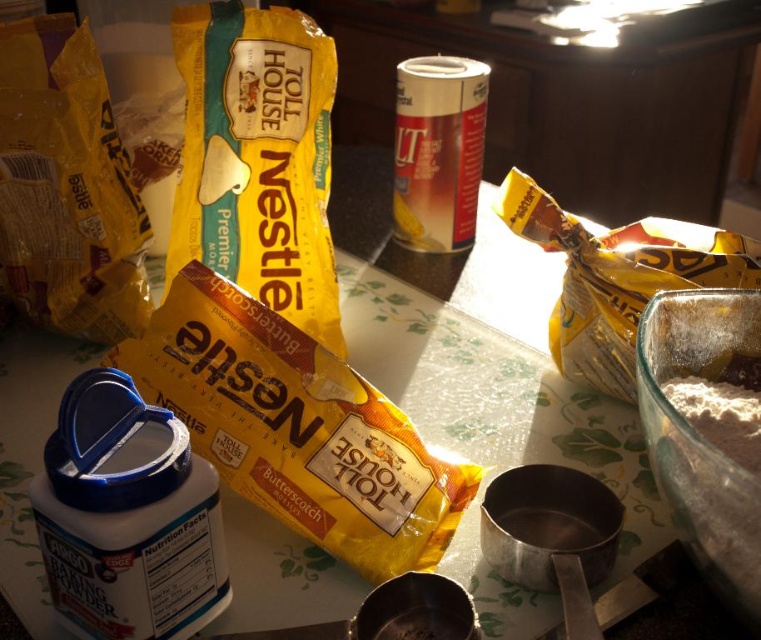
You are a baker preparing to measure ingredients for a recipe. You need to place both the yellow matte plastic bag of nestle toll house premier butter at center and the white powdery flour at right onto a shelf that can only hold items no wider than 12 inches. Based on their widths, will both items fit on the shelf together?

The yellow matte plastic bag of nestle toll house premier butter at center might be wider than white powdery flour at right. Since the shelf has a 12 inch width limit, if the bag is wider than the flour, their combined width may exceed the shelf capacity. However, without exact measurements, it is uncertain if both will fit.

You are a baker preparing to measure ingredients for a recipe. You need to retrieve the flour first. Based on the scene, where is the white powdery flour at right located in relation to the metallic silver can at center?

The white powdery flour at right is positioned under the metallic silver can at center, so it is directly below the can.